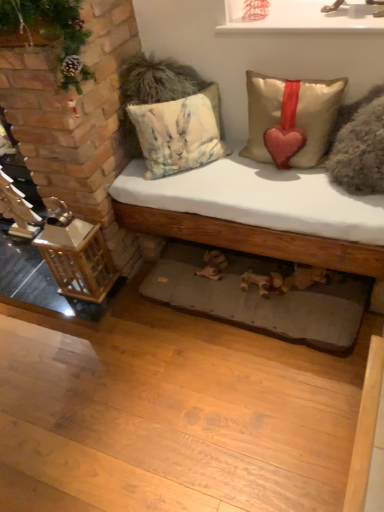
What do you see at coordinates (291, 119) in the screenshot?
I see `satin gold pillow with red heart at upper center, positioned as the 2th pillow in left-to-right order` at bounding box center [291, 119].

What do you see at coordinates (359, 145) in the screenshot? The height and width of the screenshot is (512, 384). I see `satin beige cushion at right, the first pillow positioned from the right` at bounding box center [359, 145].

Identify the location of white glossy shelf at upper center. (300, 16).

The height and width of the screenshot is (512, 384). Find the location of `satin gold pillow with red heart at upper center, the second pillow from the right`. satin gold pillow with red heart at upper center, the second pillow from the right is located at coordinates (291, 119).

Can you confirm if watercolor fabric pillow at center, which is the 1th pillow in left-to-right order, is thinner than white glossy shelf at upper center?

Indeed, watercolor fabric pillow at center, which is the 1th pillow in left-to-right order, has a lesser width compared to white glossy shelf at upper center.

Can you confirm if watercolor fabric pillow at center, the third pillow from the right, is taller than white glossy shelf at upper center?

Yes.

Is watercolor fabric pillow at center, which is the 1th pillow in left-to-right order, surrounding white glossy shelf at upper center?

No, white glossy shelf at upper center is not inside watercolor fabric pillow at center, which is the 1th pillow in left-to-right order.

Is point (171, 158) more distant than point (282, 24)?

Yes.

Is watercolor fabric pillow at center, which is the 1th pillow in left-to-right order, positioned with its back to wooden lantern at left?

No, watercolor fabric pillow at center, which is the 1th pillow in left-to-right order, is not facing away from wooden lantern at left.

Find the location of a particular element. The image size is (384, 512). crate below the watercolor fabric pillow at center, which is the 1th pillow in left-to-right order (from the image's perspective) is located at coordinates (78, 260).

From the image's perspective, is watercolor fabric pillow at center, which is the 1th pillow in left-to-right order, located beneath wooden lantern at left?

Incorrect, from the image's perspective, watercolor fabric pillow at center, which is the 1th pillow in left-to-right order, is higher than wooden lantern at left.

I want to click on the 3rd pillow above the gray fabric mat at lower center (from the image's perspective), so click(179, 133).

Could you tell me if gray fabric mat at lower center is turned towards watercolor fabric pillow at center, the third pillow from the right?

No, gray fabric mat at lower center is not facing towards watercolor fabric pillow at center, the third pillow from the right.

Between wooden lantern at left and satin gold pillow with red heart at upper center, positioned as the 2th pillow in left-to-right order, which one has less height?

satin gold pillow with red heart at upper center, positioned as the 2th pillow in left-to-right order.

Locate an element on the screen. The image size is (384, 512). the 2nd pillow positioned above the wooden lantern at left (from a real-world perspective) is located at coordinates (291, 119).

Is wooden lantern at left not near satin gold pillow with red heart at upper center, the second pillow from the right?

No, wooden lantern at left is in close proximity to satin gold pillow with red heart at upper center, the second pillow from the right.

From their relative heights in the image, would you say gray fabric mat at lower center is taller or shorter than wooden lantern at left?

Clearly, gray fabric mat at lower center is shorter compared to wooden lantern at left.

What's the angular difference between gray fabric mat at lower center and wooden lantern at left's facing directions?

The angular difference between gray fabric mat at lower center and wooden lantern at left is 0.000796 degrees.

Does gray fabric mat at lower center touch wooden lantern at left?

They are not placed beside each other.

Based on the photo, does gray fabric mat at lower center turn towards wooden lantern at left?

No.

From a real-world perspective, does gray fabric mat at lower center stand above white glossy shelf at upper center?

No.

Based on their positions, is gray fabric mat at lower center located to the left or right of white glossy shelf at upper center?

Clearly, gray fabric mat at lower center is on the left of white glossy shelf at upper center in the image.

Does gray fabric mat at lower center lie in front of white glossy shelf at upper center?

No, gray fabric mat at lower center is behind white glossy shelf at upper center.

From the image's perspective, between gray fabric mat at lower center and white glossy shelf at upper center, which one is located above?

white glossy shelf at upper center appears higher in the image.

Who is taller, watercolor fabric pillow at center, which is the 1th pillow in left-to-right order, or satin gold pillow with red heart at upper center, positioned as the 2th pillow in left-to-right order?

Standing taller between the two is watercolor fabric pillow at center, which is the 1th pillow in left-to-right order.

Is the position of watercolor fabric pillow at center, the third pillow from the right, less distant than that of satin gold pillow with red heart at upper center, positioned as the 2th pillow in left-to-right order?

No, watercolor fabric pillow at center, the third pillow from the right, is further to the viewer.

Are watercolor fabric pillow at center, which is the 1th pillow in left-to-right order, and satin gold pillow with red heart at upper center, positioned as the 2th pillow in left-to-right order, located far from each other?

No, watercolor fabric pillow at center, which is the 1th pillow in left-to-right order, is in close proximity to satin gold pillow with red heart at upper center, positioned as the 2th pillow in left-to-right order.

Considering the sizes of watercolor fabric pillow at center, which is the 1th pillow in left-to-right order, and satin gold pillow with red heart at upper center, positioned as the 2th pillow in left-to-right order, in the image, is watercolor fabric pillow at center, which is the 1th pillow in left-to-right order, bigger or smaller than satin gold pillow with red heart at upper center, positioned as the 2th pillow in left-to-right order,?

In the image, watercolor fabric pillow at center, which is the 1th pillow in left-to-right order, appears to be smaller than satin gold pillow with red heart at upper center, positioned as the 2th pillow in left-to-right order.

Image resolution: width=384 pixels, height=512 pixels. In order to click on pillow that is the 2nd one when counting leftward from the white glossy shelf at upper center in this screenshot , I will do `click(179, 133)`.

You are a GUI agent. You are given a task and a screenshot of the screen. Output one action in this format:
    pyautogui.click(x=<x>, y=<y>)
    Task: Click on the crate located below the watercolor fabric pillow at center, which is the 1th pillow in left-to-right order (from the image's perspective)
    
    Given the screenshot: What is the action you would take?
    pyautogui.click(x=78, y=260)

Considering their positions, is wooden lantern at left positioned further to white glossy shelf at upper center than white cotton bed at center?

The object further to white glossy shelf at upper center is wooden lantern at left.

Based on their spatial positions, is wooden lantern at left or white cotton bed at center closer to watercolor fabric pillow at center, the third pillow from the right?

Among the two, wooden lantern at left is located nearer to watercolor fabric pillow at center, the third pillow from the right.

When comparing their distances from satin beige cushion at right, which is the third pillow from left to right, does watercolor fabric pillow at center, the third pillow from the right, or wooden lantern at left seem further?

Among the two, wooden lantern at left is located further to satin beige cushion at right, which is the third pillow from left to right.

Estimate the real-world distances between objects in this image. Which object is further from white glossy shelf at upper center, watercolor fabric pillow at center, the third pillow from the right, or gray fabric mat at lower center?

Among the two, gray fabric mat at lower center is located further to white glossy shelf at upper center.

Considering their positions, is wooden lantern at left positioned further to gray fabric mat at lower center than satin gold pillow with red heart at upper center, the second pillow from the right?

satin gold pillow with red heart at upper center, the second pillow from the right, is further to gray fabric mat at lower center.

Looking at the image, which one is located further to white cotton bed at center, watercolor fabric pillow at center, the third pillow from the right, or gray fabric mat at lower center?

The object further to white cotton bed at center is watercolor fabric pillow at center, the third pillow from the right.

Estimate the real-world distances between objects in this image. Which object is further from watercolor fabric pillow at center, which is the 1th pillow in left-to-right order, satin gold pillow with red heart at upper center, positioned as the 2th pillow in left-to-right order, or white cotton bed at center?

Based on the image, white cotton bed at center appears to be further to watercolor fabric pillow at center, which is the 1th pillow in left-to-right order.

Based on their spatial positions, is satin beige cushion at right, which is the third pillow from left to right, or gray fabric mat at lower center further from satin gold pillow with red heart at upper center, positioned as the 2th pillow in left-to-right order?

gray fabric mat at lower center is further to satin gold pillow with red heart at upper center, positioned as the 2th pillow in left-to-right order.

Locate an element on the screen. bed between watercolor fabric pillow at center, the third pillow from the right, and satin gold pillow with red heart at upper center, positioned as the 2th pillow in left-to-right order, in the horizontal direction is located at coordinates (254, 289).

I want to click on bed between wooden lantern at left and satin beige cushion at right, the first pillow positioned from the right, in the horizontal direction, so click(254, 289).

The image size is (384, 512). I want to click on bed between watercolor fabric pillow at center, the third pillow from the right, and satin beige cushion at right, which is the third pillow from left to right, so click(254, 289).

You are a GUI agent. You are given a task and a screenshot of the screen. Output one action in this format:
    pyautogui.click(x=<x>, y=<y>)
    Task: Click on the pillow between wooden lantern at left and gray fabric mat at lower center from left to right
    The image size is (384, 512).
    Given the screenshot: What is the action you would take?
    pyautogui.click(x=179, y=133)